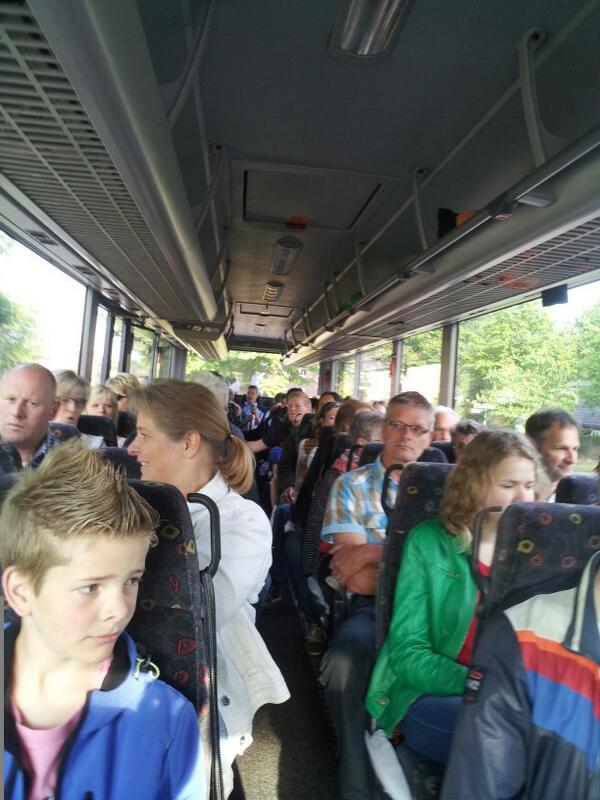
Locate an element on the screen. This screenshot has height=800, width=600. seat is located at coordinates (509, 558), (580, 494), (416, 473), (178, 590).